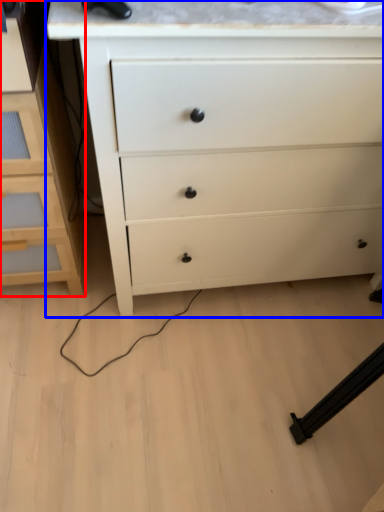
Question: Which object appears farthest to the camera in this image, chest of drawers (highlighted by a red box) or chest of drawers (highlighted by a blue box)?

Choices:
 (A) chest of drawers
 (B) chest of drawers

Answer: (A)